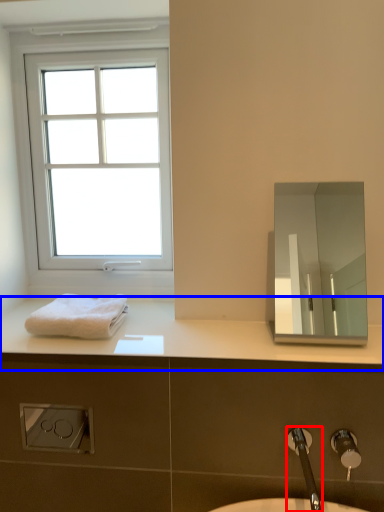
Question: Which of the following is the farthest to the observer, tap (highlighted by a red box) or counter top (highlighted by a blue box)?

Choices:
 (A) tap
 (B) counter top

Answer: (B)